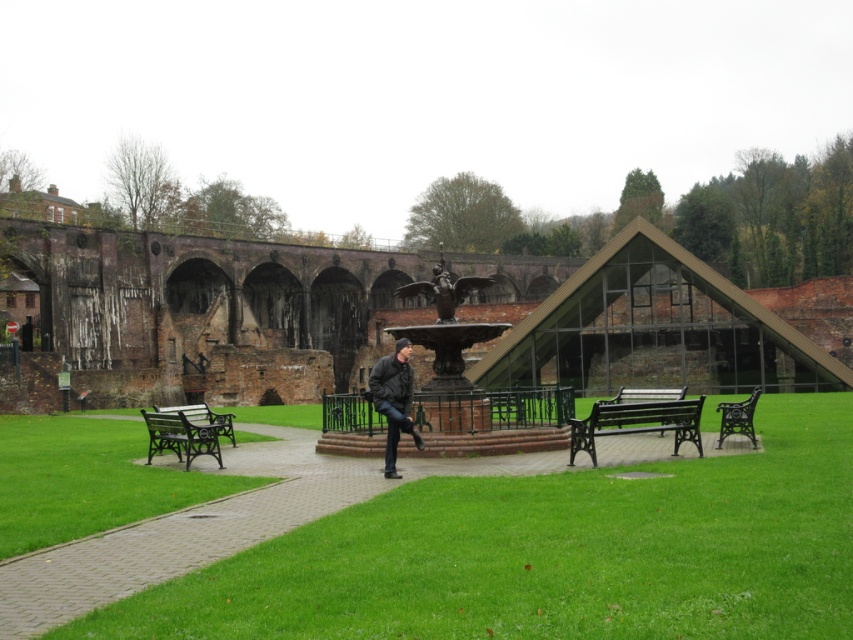
Question: Which object appears farthest from the camera in this image?

Choices:
 (A) green wrought iron bench at lower left
 (B) dark gray leather jacket at center
 (C) black wrought iron bench at lower right

Answer: (A)

Question: Can you confirm if green wrought iron bench at center is positioned to the left of black wrought iron bench at lower right?

Choices:
 (A) no
 (B) yes

Answer: (B)

Question: Among these objects, which one is farthest from the camera?

Choices:
 (A) green grass at center
 (B) green wrought iron bench at center

Answer: (B)

Question: Which object appears farthest from the camera in this image?

Choices:
 (A) green grass at center
 (B) green wrought iron bench at lower left

Answer: (B)

Question: Is green wrought iron bench at center in front of dark gray leather jacket at center?

Choices:
 (A) yes
 (B) no

Answer: (A)

Question: From the image, what is the correct spatial relationship of green wrought iron bench at center in relation to dark gray leather jacket at center?

Choices:
 (A) above
 (B) below

Answer: (B)